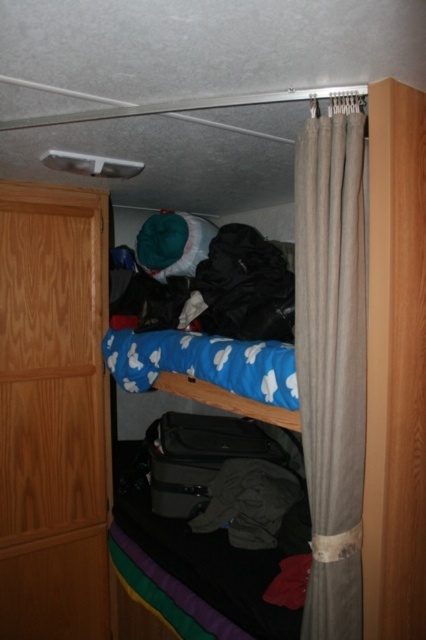
You are organizing the living space and need to decide which item takes up more space. Which item is larger in size between the beige fabric curtain at right and the gray cotton shirt at lower center?

The beige fabric curtain at right has a larger size compared to the gray cotton shirt at lower center, so the beige fabric curtain at right takes up more space.

You are trying to reach the gray cotton shirt at lower center from where you are standing near the black fabric at center. Can you grab it without moving your feet?

The distance between the black fabric at center and the gray cotton shirt at lower center is 22.59 inches, so you can likely reach it without moving your feet if your arm length exceeds this distance.